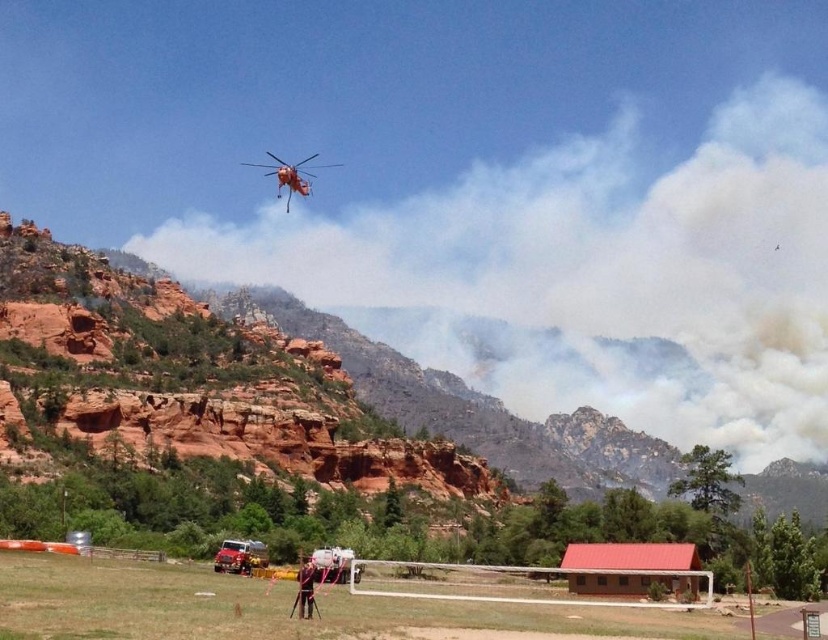
Question: Among these objects, which one is farthest from the camera?

Choices:
 (A) orange matte helicopter at upper center
 (B) dark brown leather jacket at lower center

Answer: (A)

Question: Does orange matte helicopter at upper center appear on the right side of dark brown leather jacket at lower center?

Choices:
 (A) no
 (B) yes

Answer: (A)

Question: Is orange matte helicopter at upper center positioned at the back of dark brown leather jacket at lower center?

Choices:
 (A) yes
 (B) no

Answer: (A)

Question: Which object appears closest to the camera in this image?

Choices:
 (A) orange matte helicopter at upper center
 (B) dark brown leather jacket at lower center

Answer: (B)

Question: Does orange matte helicopter at upper center appear on the left side of dark brown leather jacket at lower center?

Choices:
 (A) no
 (B) yes

Answer: (B)